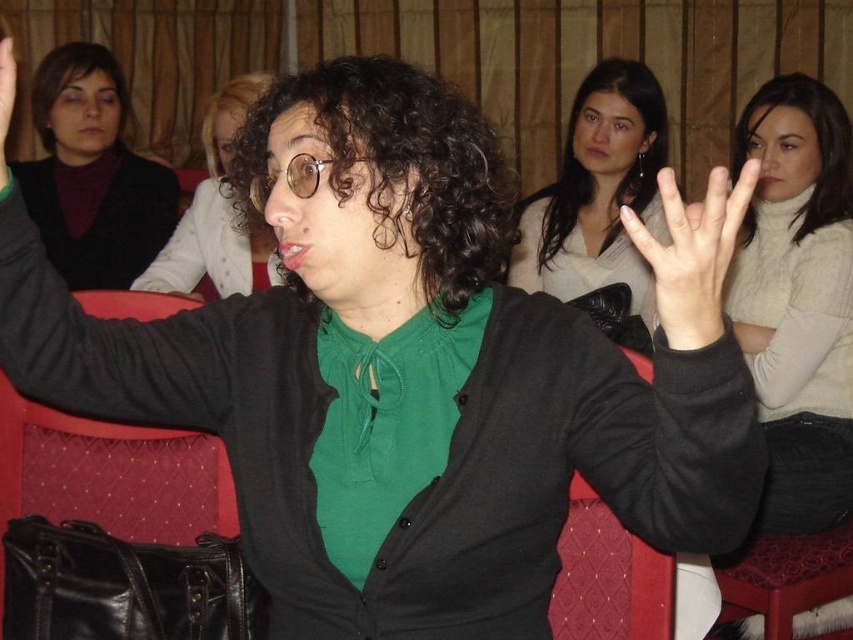
Who is more forward, [729,253] or [227,93]?

Point [729,253]

Which is behind, point (683, 337) or point (229, 120)?

The point (229, 120) is more distant.

Between point (723, 236) and point (264, 88), which one is positioned behind?

The point (264, 88) is more distant.

Find the location of `smooth skin hand at center`. smooth skin hand at center is located at coordinates (693, 253).

Can you confirm if matte black sweater at upper left is taller than matte black hand at upper center?

Yes.

Which of these two, matte black sweater at upper left or matte black hand at upper center, stands taller?

matte black sweater at upper left

Is point (169, 200) closer to viewer compared to point (10, 67)?

No, it is behind (10, 67).

I want to click on matte black sweater at upper left, so click(x=106, y=180).

Who is shorter, smooth skin hand at center or matte black hand at upper center?

matte black hand at upper center

Is smooth skin hand at center positioned behind matte black hand at upper center?

No, smooth skin hand at center is in front of matte black hand at upper center.

Which is in front, point (682, 230) or point (6, 106)?

Point (682, 230)

Locate an element on the screen. smooth skin hand at center is located at coordinates (693, 253).